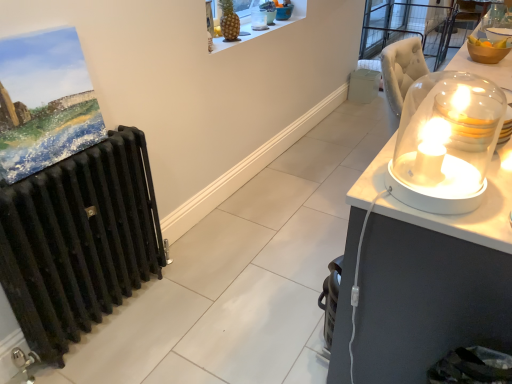
Question: From the image's perspective, is translucent glass dome at upper center, the 1th candle holder viewed from the top, above or below translucent glass dome at upper right, positioned as the second candle holder in top-to-bottom order?

Choices:
 (A) below
 (B) above

Answer: (B)

Question: From a real-world perspective, is translucent glass dome at upper center, the first candle holder positioned from the back, above or below translucent glass dome at upper right, marked as the second candle holder in a back-to-front arrangement?

Choices:
 (A) below
 (B) above

Answer: (B)

Question: Which object is positioned closest to the golden pineapple at upper center?

Choices:
 (A) translucent glass dome at upper center, the 1th candle holder viewed from the top
 (B) white plastic trash bin/can at right
 (C) translucent glass dome at upper right, which appears as the 3th candle holder when viewed from the front
 (D) translucent glass candle at right, placed as the third candle holder when sorted from back to front
 (E) white glossy candle holder at right, the 1th candle holder positioned from the front

Answer: (A)

Question: Considering the real-world distances, which object is closest to the translucent glass candle at right, which ranks as the 3th candle holder in left-to-right order?

Choices:
 (A) white glossy candle holder at right, the fourth candle holder when ordered from top to bottom
 (B) transparent glass dome at right
 (C) translucent glass dome at upper center, which is the 1th candle holder from left to right
 (D) golden pineapple at upper center
 (E) white plastic trash bin/can at right

Answer: (A)